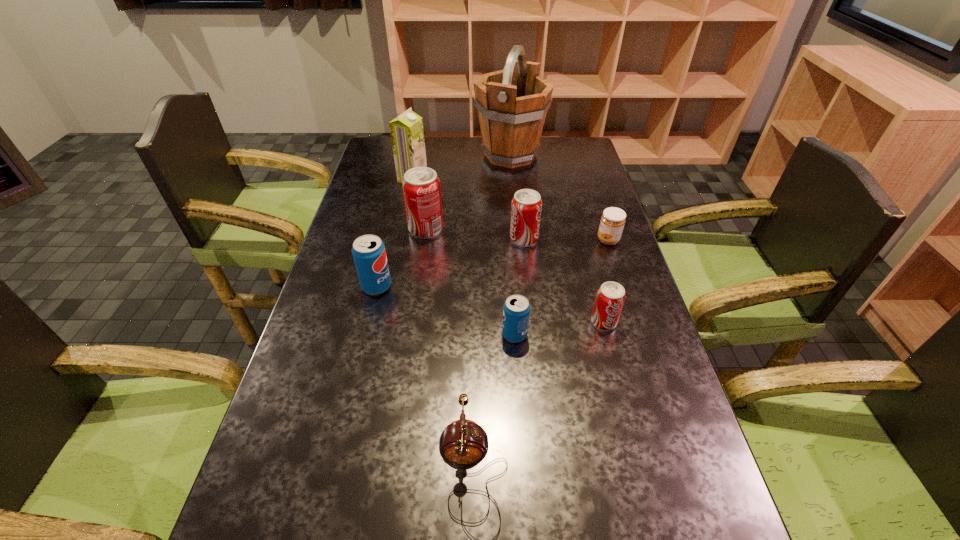
Where is `blank space located 0.170m on the back of the nearer blue soda can`? blank space located 0.170m on the back of the nearer blue soda can is located at coordinates (511, 278).

At what (x,y) coordinates should I click in order to perform the action: click on free spot located on the front label of the orange jam. Please return your answer as a coordinate pair (x, y). Looking at the image, I should click on (515, 240).

Where is `vacant space situated 0.120m on the front label of the orange jam`? This screenshot has height=540, width=960. vacant space situated 0.120m on the front label of the orange jam is located at coordinates (557, 240).

The height and width of the screenshot is (540, 960). Find the location of `vacant region located on the front label of the orange jam`. vacant region located on the front label of the orange jam is located at coordinates (534, 240).

Find the location of `object located in the far edge section of the desktop`. object located in the far edge section of the desktop is located at coordinates point(512,103).

Identify the location of soya milk at the left edge. The width and height of the screenshot is (960, 540). (407, 134).

Where is `soda can that is at the left edge`? soda can that is at the left edge is located at coordinates (368, 251).

Where is `soda can at the right edge`? soda can at the right edge is located at coordinates (610, 297).

Locate an element on the screen. jam at the right edge is located at coordinates (612, 222).

The height and width of the screenshot is (540, 960). I want to click on blank space at the far edge of the desktop, so click(x=470, y=156).